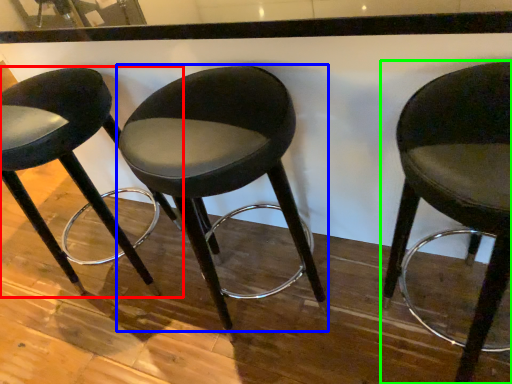
Question: Which object is positioned farthest from chair (highlighted by a red box)? Select from chair (highlighted by a blue box) and chair (highlighted by a green box).

Choices:
 (A) chair
 (B) chair

Answer: (B)